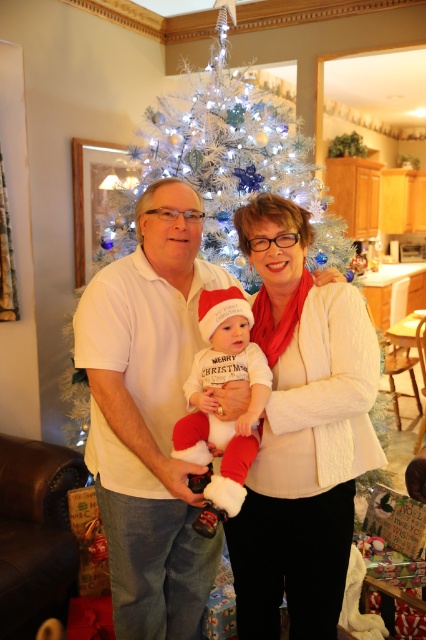
Question: Which point is farther to the camera?

Choices:
 (A) (238, 144)
 (B) (235, 481)
 (C) (276, 397)
 (D) (138, 275)

Answer: (A)

Question: Which of the following is the closest to the observer?

Choices:
 (A) white artificial christmas tree at center
 (B) white cotton shirt at center
 (C) white soft baby at center
 (D) white cable-knit sweater at center

Answer: (C)

Question: Does white cable-knit sweater at center have a lesser width compared to white soft baby at center?

Choices:
 (A) yes
 (B) no

Answer: (B)

Question: Which object is closer to the camera taking this photo?

Choices:
 (A) white soft baby at center
 (B) white artificial christmas tree at center

Answer: (A)

Question: Is white cable-knit sweater at center to the right of white artificial christmas tree at center from the viewer's perspective?

Choices:
 (A) yes
 (B) no

Answer: (A)

Question: Can you confirm if white cable-knit sweater at center is smaller than white artificial christmas tree at center?

Choices:
 (A) yes
 (B) no

Answer: (A)